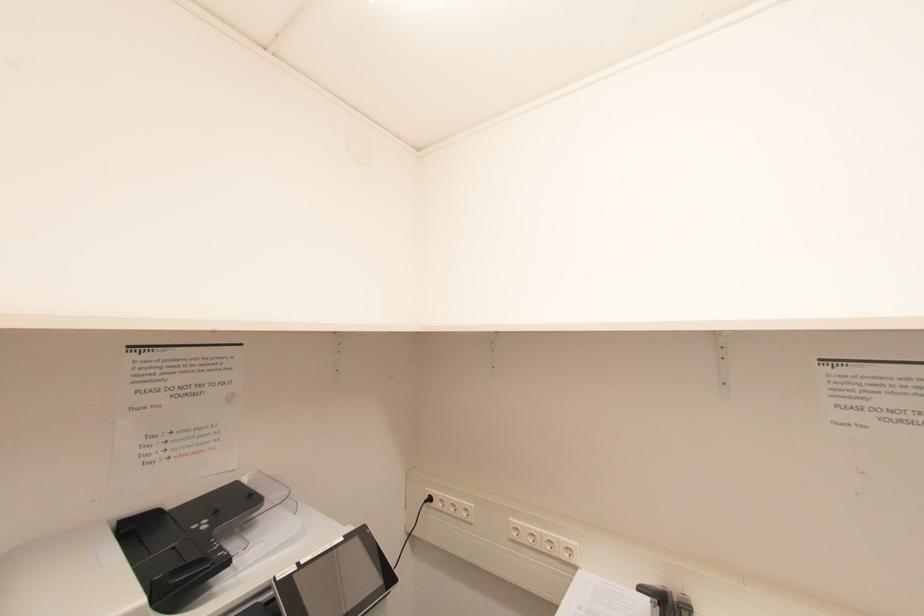
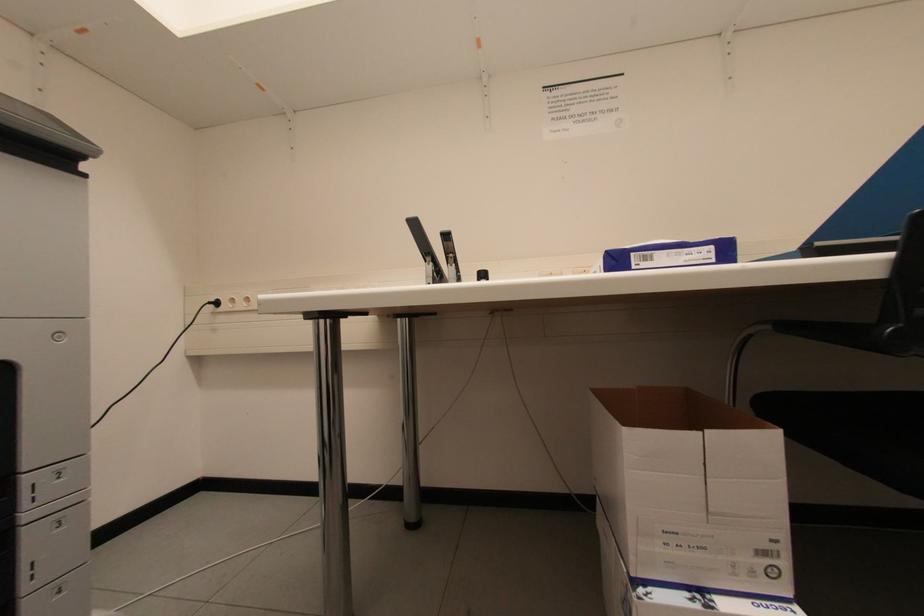
Which direction would the cameraman need to move to produce the second image?

The cameraman walked toward right, backward.